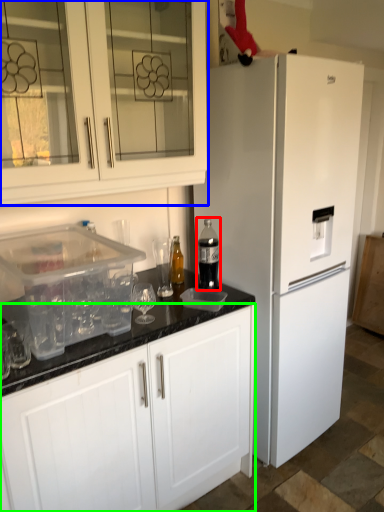
Question: Which object is positioned closest to bottle (highlighted by a red box)? Select from cabinetry (highlighted by a blue box) and cabinetry (highlighted by a green box).

Choices:
 (A) cabinetry
 (B) cabinetry

Answer: (A)